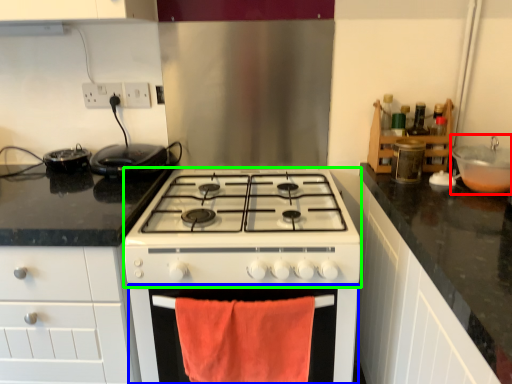
Question: Which is nearer to the sink (highlighted by a red box)? oven (highlighted by a blue box) or gas stove (highlighted by a green box).

Choices:
 (A) oven
 (B) gas stove

Answer: (B)